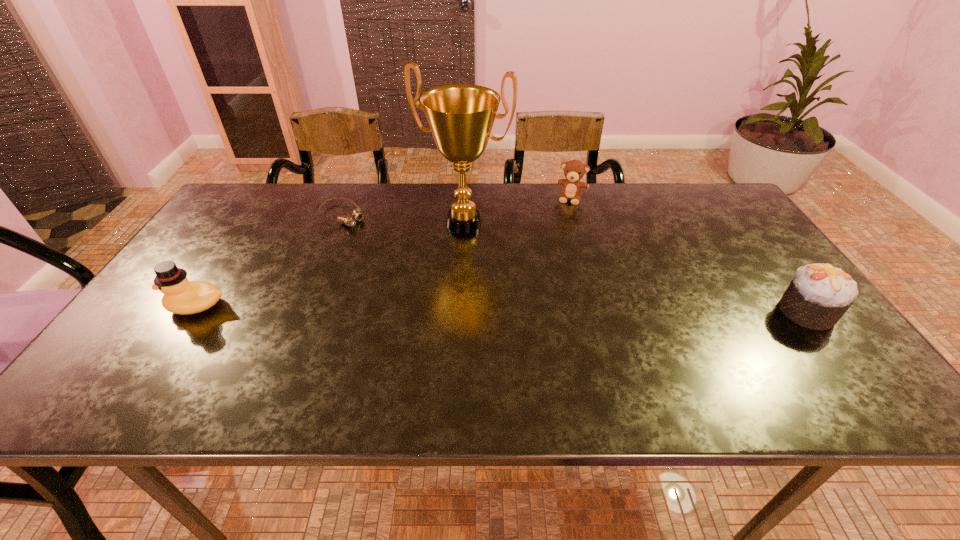
Where is `object located in the left edge section of the desktop`? object located in the left edge section of the desktop is located at coordinates (181, 296).

I want to click on object that is positioned at the right edge, so click(819, 295).

What are the coordinates of `free space at the far edge of the desktop` in the screenshot? It's located at pyautogui.click(x=315, y=211).

This screenshot has width=960, height=540. Identify the location of free space at the near edge. (366, 362).

The height and width of the screenshot is (540, 960). In the image, there is a desktop. Identify the location of vacant area at the left edge. (209, 230).

This screenshot has height=540, width=960. What are the coordinates of `vacant space at the right edge` in the screenshot? It's located at (710, 239).

Find the location of a particular element. free space at the far left corner of the desktop is located at coordinates (x=272, y=208).

Locate an element on the screen. free space at the near right corner is located at coordinates (839, 352).

Where is `vacant region between the tallest object and the shortest object`? vacant region between the tallest object and the shortest object is located at coordinates (403, 219).

Locate an element on the screen. The height and width of the screenshot is (540, 960). vacant region between the leftmost object and the award is located at coordinates (330, 264).